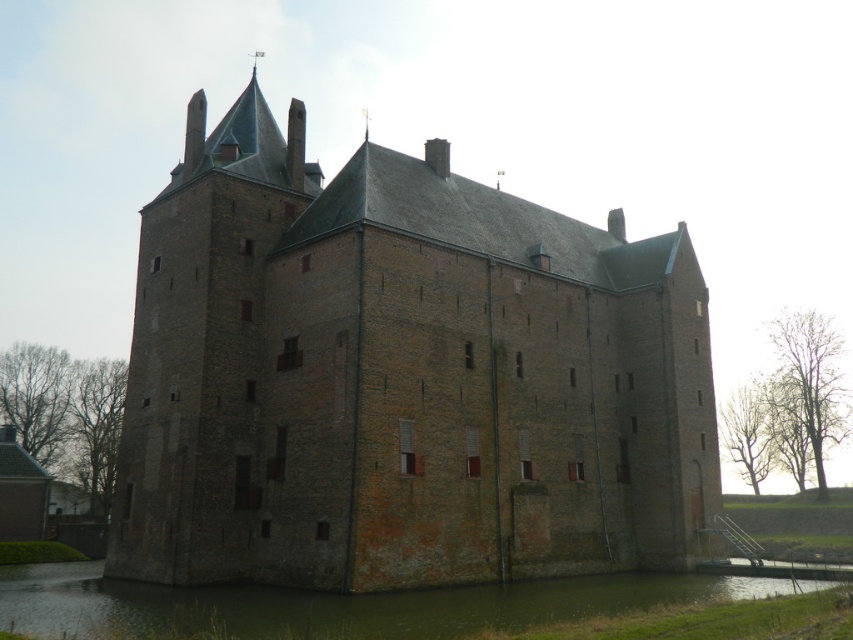
Question: Which point appears closest to the camera in this image?

Choices:
 (A) (633, 552)
 (B) (654, 592)

Answer: (B)

Question: Which point is closer to the camera?

Choices:
 (A) (276, 541)
 (B) (509, 625)

Answer: (B)

Question: Does brown brick castle at center have a larger size compared to green grassy bank at lower center?

Choices:
 (A) no
 (B) yes

Answer: (B)

Question: Where is brown brick castle at center located in relation to green grassy bank at lower center in the image?

Choices:
 (A) above
 (B) below

Answer: (A)

Question: In this image, where is brown brick castle at center located relative to green grassy bank at lower center?

Choices:
 (A) below
 (B) above

Answer: (B)